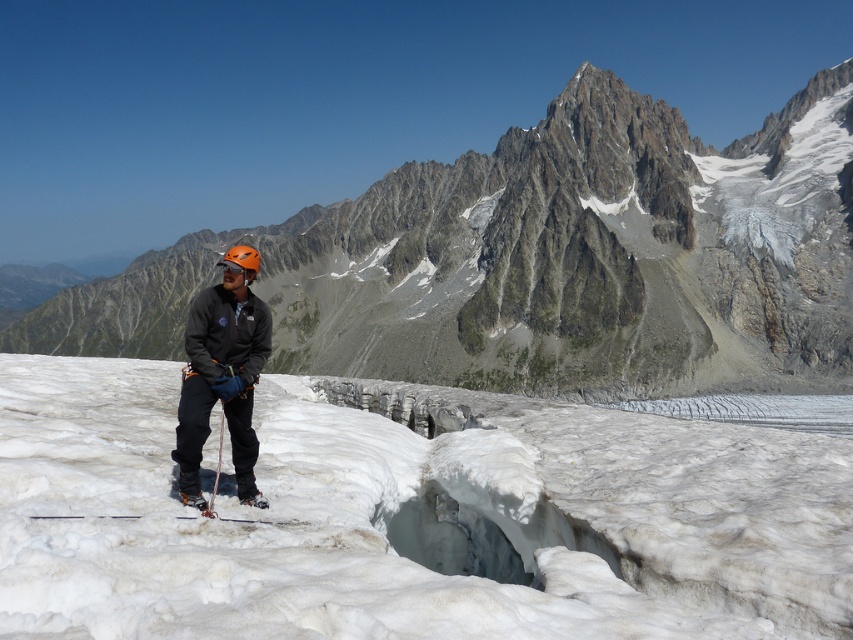
Is rugged granite mountain at center bigger than matte black jacket at center?

Correct, rugged granite mountain at center is larger in size than matte black jacket at center.

Who is more distant from viewer, (635, 227) or (241, 330)?

The point (635, 227) is behind.

Who is more forward, (773, 266) or (236, 356)?

Point (236, 356) is more forward.

Locate an element on the screen. This screenshot has width=853, height=640. rugged granite mountain at center is located at coordinates (541, 260).

Does white frosty snow at center have a smaller size compared to white plastic ski at center?

No, white frosty snow at center is not smaller than white plastic ski at center.

Does white frosty snow at center lie in front of white plastic ski at center?

Yes, it is.

Image resolution: width=853 pixels, height=640 pixels. What do you see at coordinates (412, 518) in the screenshot?
I see `white frosty snow at center` at bounding box center [412, 518].

Locate an element on the screen. The height and width of the screenshot is (640, 853). white frosty snow at center is located at coordinates (412, 518).

Can you confirm if rugged granite mountain at center is shorter than white plastic ski at center?

Incorrect, rugged granite mountain at center's height does not fall short of white plastic ski at center's.

Between rugged granite mountain at center and white plastic ski at center, which one appears on the left side from the viewer's perspective?

From the viewer's perspective, rugged granite mountain at center appears more on the left side.

What are the coordinates of `rugged granite mountain at center` in the screenshot? It's located at (541, 260).